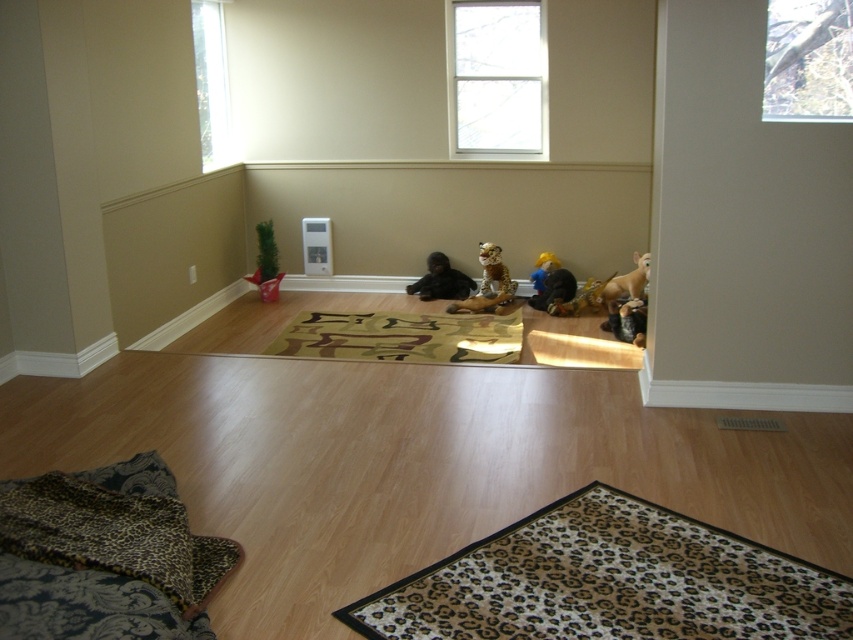
Question: Which object is the closest to the transparent glass window at upper right?

Choices:
 (A) clear glass window at upper center
 (B) leopard print plush at center
 (C) clear glass window at upper left

Answer: (B)

Question: Estimate the real-world distances between objects in this image. Which object is closer to the black plush monkey at center?

Choices:
 (A) light brown plastic horse at lower right
 (B) plush yellow bear at center

Answer: (B)

Question: Is clear glass window at upper center closer to camera compared to plush yellow bear at center?

Choices:
 (A) yes
 (B) no

Answer: (B)

Question: In this image, where is clear glass window at upper left located relative to leopard print plush at center?

Choices:
 (A) left
 (B) right

Answer: (A)

Question: Can you confirm if transparent glass window at upper right is positioned above leopard print plush toy at center?

Choices:
 (A) no
 (B) yes

Answer: (B)

Question: Which is nearer to the black plush monkey at center?

Choices:
 (A) plush yellow bear at center
 (B) green fabric plant at lower left

Answer: (A)